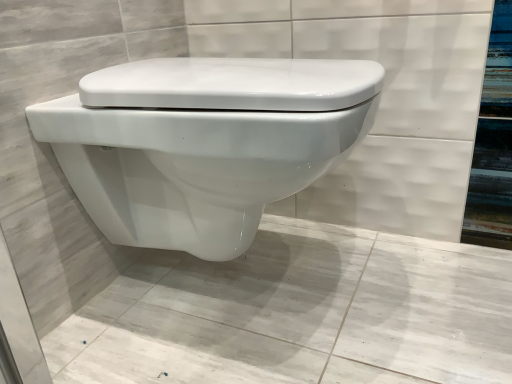
Where is `free spot below white glossy toilet at center (from a real-world perspective)`? free spot below white glossy toilet at center (from a real-world perspective) is located at coordinates (259, 294).